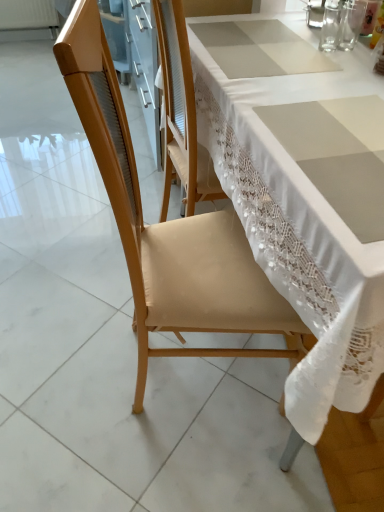
Question: Can you confirm if transparent glass at upper right, arranged as the 2th tableware when viewed from the right, is shorter than transparent glass at upper right, marked as the 3th tableware in a left-to-right arrangement?

Choices:
 (A) yes
 (B) no

Answer: (A)

Question: Considering the relative sizes of transparent glass at upper right, the 2th tableware positioned from the left, and transparent glass at upper right, marked as the 3th tableware in a left-to-right arrangement, in the image provided, is transparent glass at upper right, the 2th tableware positioned from the left, thinner than transparent glass at upper right, marked as the 3th tableware in a left-to-right arrangement,?

Choices:
 (A) no
 (B) yes

Answer: (A)

Question: Does transparent glass at upper right, the 2th tableware positioned from the left, appear on the left side of transparent glass at upper right, the 1th tableware from the right?

Choices:
 (A) no
 (B) yes

Answer: (B)

Question: Is transparent glass at upper right, the 2th tableware positioned from the left, oriented away from transparent glass at upper right, the 1th tableware from the right?

Choices:
 (A) no
 (B) yes

Answer: (B)

Question: Is transparent glass at upper right, arranged as the 2th tableware when viewed from the right, not within transparent glass at upper right, the 1th tableware from the right?

Choices:
 (A) yes
 (B) no

Answer: (A)

Question: Based on their sizes in the image, would you say clear glass at upper right, acting as the first tableware starting from the left, is bigger or smaller than transparent glass at upper right, the 1th tableware from the right?

Choices:
 (A) big
 (B) small

Answer: (A)

Question: In the image, is clear glass at upper right, which appears as the 3th tableware when viewed from the right, positioned in front of or behind transparent glass at upper right, marked as the 3th tableware in a left-to-right arrangement?

Choices:
 (A) behind
 (B) front

Answer: (A)

Question: Is clear glass at upper right, acting as the first tableware starting from the left, spatially inside transparent glass at upper right, marked as the 3th tableware in a left-to-right arrangement, or outside of it?

Choices:
 (A) inside
 (B) outside

Answer: (B)

Question: From the image's perspective, is clear glass at upper right, which appears as the 3th tableware when viewed from the right, located above or below transparent glass at upper right, marked as the 3th tableware in a left-to-right arrangement?

Choices:
 (A) above
 (B) below

Answer: (A)

Question: Considering the positions of point (329, 23) and point (307, 7), is point (329, 23) closer or farther from the camera than point (307, 7)?

Choices:
 (A) closer
 (B) farther

Answer: (A)

Question: Relative to clear glass at upper right, which appears as the 3th tableware when viewed from the right, is transparent glass at upper right, arranged as the 2th tableware when viewed from the right, in front or behind?

Choices:
 (A) behind
 (B) front

Answer: (B)

Question: Choose the correct answer: Is transparent glass at upper right, the 2th tableware positioned from the left, inside clear glass at upper right, which appears as the 3th tableware when viewed from the right, or outside it?

Choices:
 (A) outside
 (B) inside

Answer: (A)

Question: Considering the positions of transparent glass at upper right, arranged as the 2th tableware when viewed from the right, and clear glass at upper right, acting as the first tableware starting from the left, in the image, is transparent glass at upper right, arranged as the 2th tableware when viewed from the right, taller or shorter than clear glass at upper right, acting as the first tableware starting from the left,?

Choices:
 (A) tall
 (B) short

Answer: (B)

Question: Relative to transparent glass at upper right, marked as the 3th tableware in a left-to-right arrangement, is transparent glass at upper right, arranged as the 2th tableware when viewed from the right, in front or behind?

Choices:
 (A) behind
 (B) front

Answer: (B)

Question: In terms of height, does transparent glass at upper right, arranged as the 2th tableware when viewed from the right, look taller or shorter compared to transparent glass at upper right, marked as the 3th tableware in a left-to-right arrangement?

Choices:
 (A) tall
 (B) short

Answer: (B)